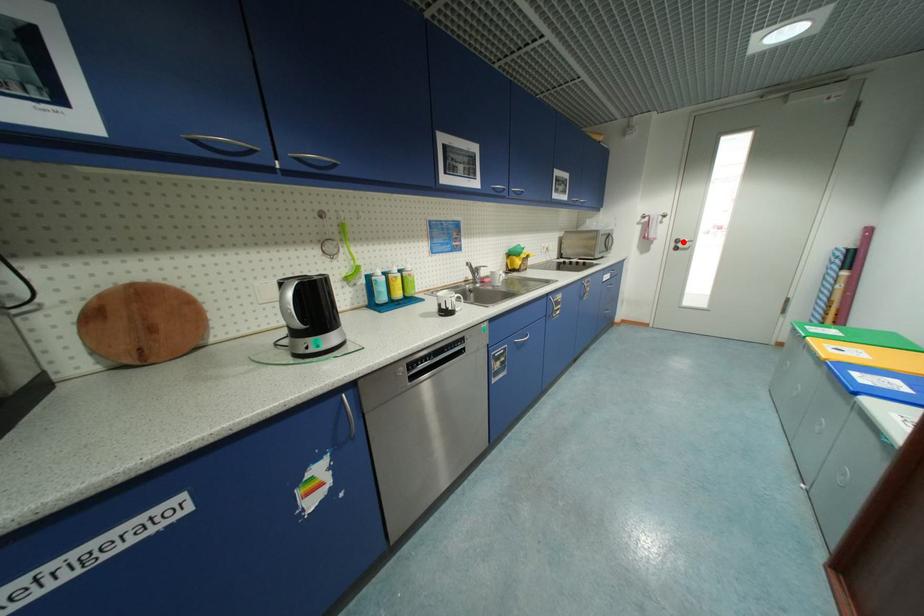
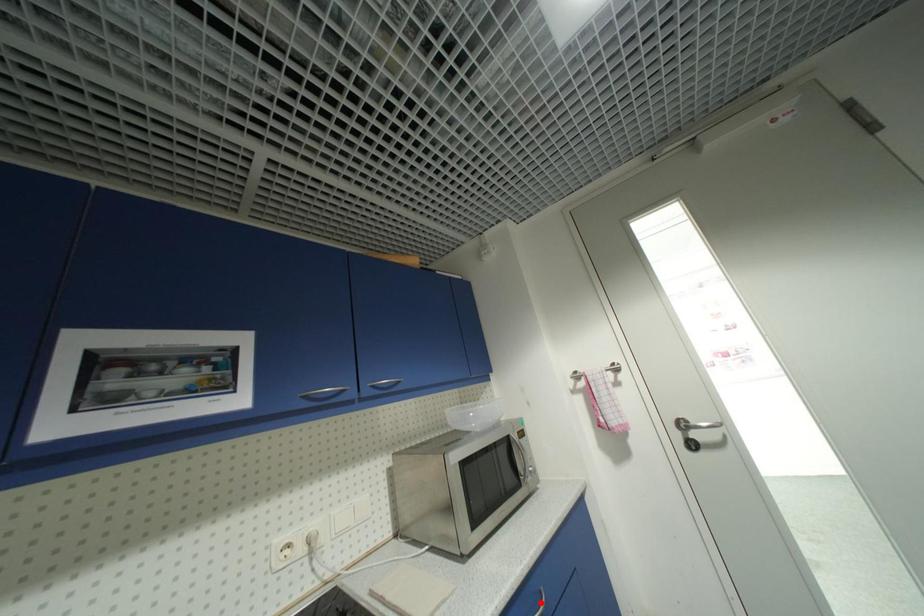
In the scene shown: I am providing you with two images of the same scene from different viewpoints. A red point is marked on the first image and another point is marked on the second image. Is the marked point in image1 the same physical position as the marked point in image2?

No